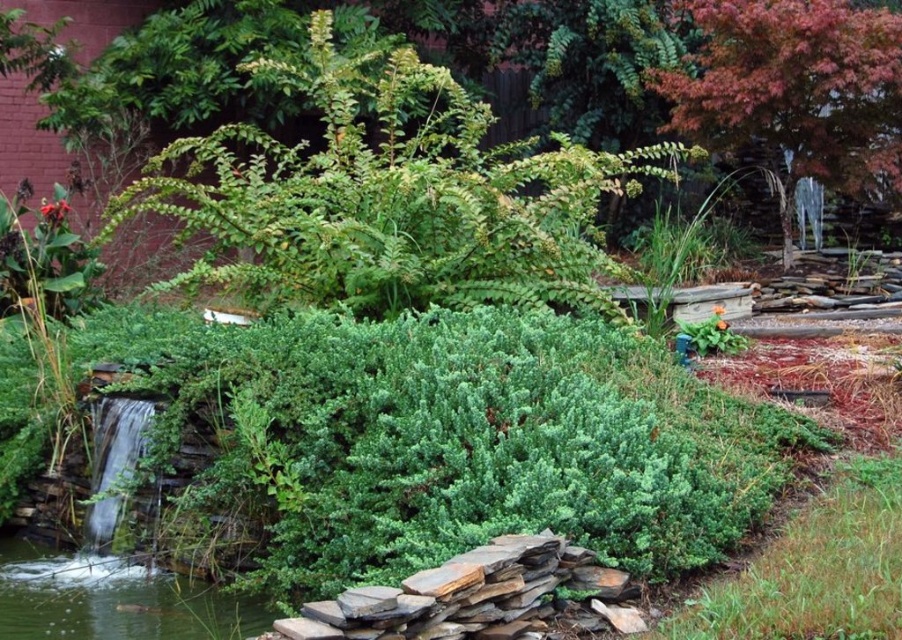
You are standing in the garden and want to place a small decorative statue exactly at point (388, 196). What will be under the statue?

The green leafy bush at upper center is located at point (388, 196), so placing the statue there would cover it.

You are a gardener planning to place a new decorative stone between the green leafy bush at upper center and the clear water at lower left. Based on their sizes, which object should you place the stone closer to?

The green leafy bush at upper center is smaller than the clear water at lower left, so you should place the decorative stone closer to the green leafy bush at upper center to balance their sizes.

You are standing in the garden scene described. A drone is flying at coordinates 0.5,0.5. Which object is closer to the drone, the green leafy bush at upper center or the waterfall on the left?

The green leafy bush at upper center is closer to the drone because its coordinates are at (388, 196), which is closer to the drone at (451, 320) than the waterfall on the left.